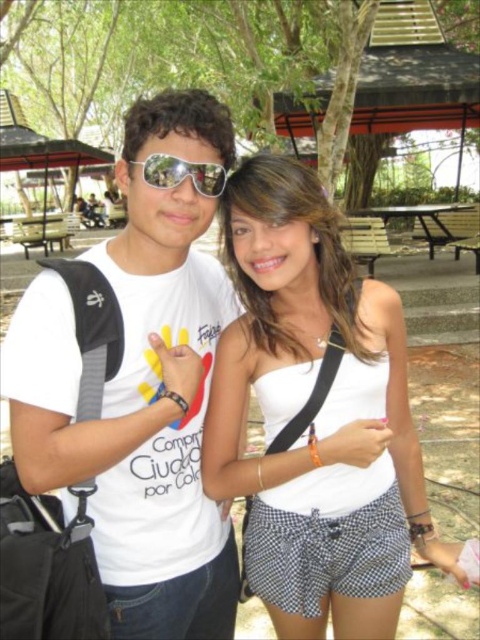
You are a fashion designer observing two outfits in a park scene. The outfits include a white cotton tank top at center and checkered fabric shorts at lower center. Which piece of clothing is positioned higher in the image?

The white cotton tank top at center is taller than checkered fabric shorts at lower center, so the white cotton tank top at center is positioned higher in the image.

Consider the image. You are standing in a park and want to reach the point marked at coordinates (31,433). If you can walk 3 feet per second, how many seconds will it take you to reach that point?

The distance between you and the point is 5.78 feet. At a walking speed of 3 feet per second, it would take approximately 1.93 seconds to reach the point.